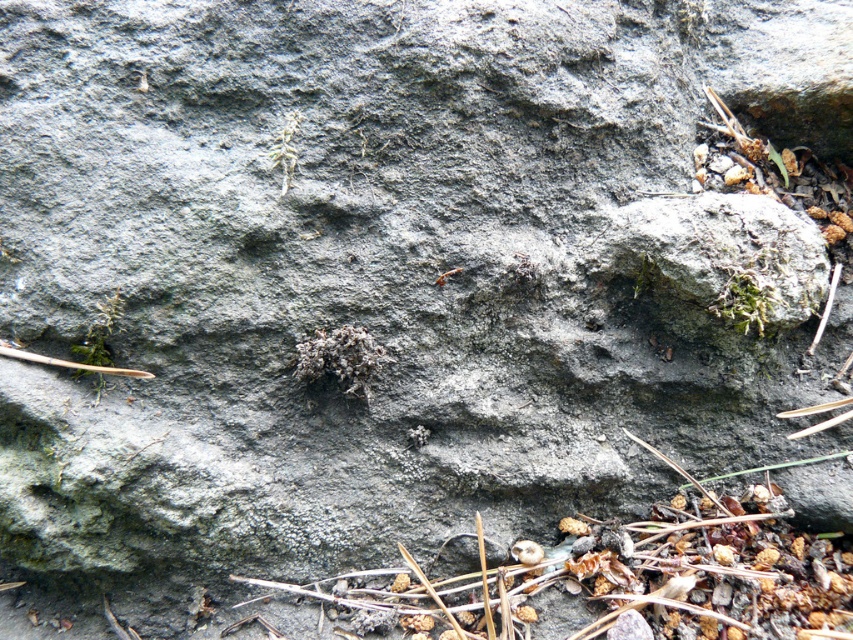
Who is positioned more to the right, fuzzy grayish-brown weed at center or green mossy weed at upper center?

fuzzy grayish-brown weed at center

Who is more distant from viewer, (320, 362) or (285, 166)?

The point (320, 362) is behind.

This screenshot has width=853, height=640. I want to click on fuzzy grayish-brown weed at center, so click(x=341, y=356).

The image size is (853, 640). Identify the location of fuzzy grayish-brown weed at center. (341, 356).